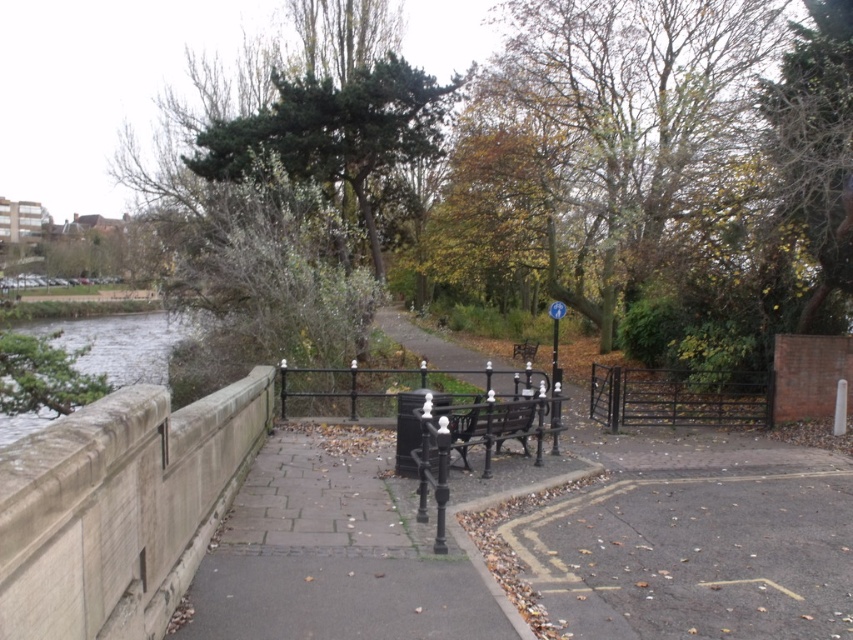
Does yellow-green foliage at upper center have a lesser width compared to black wrought iron bench at center?

Incorrect, yellow-green foliage at upper center's width is not less than black wrought iron bench at center's.

Can you confirm if yellow-green foliage at upper center is smaller than black wrought iron bench at center?

No, yellow-green foliage at upper center is not smaller than black wrought iron bench at center.

Between point (679, 145) and point (474, 417), which one is positioned behind?

The point (679, 145) is behind.

The height and width of the screenshot is (640, 853). Identify the location of yellow-green foliage at upper center. click(618, 125).

Measure the distance between clear water at edge at left and camera.

clear water at edge at left is 39.84 feet from camera.

Is point (135, 330) positioned after point (495, 403)?

Yes, point (135, 330) is behind point (495, 403).

In order to click on clear water at edge at left in this screenshot , I will do `click(119, 342)`.

Who is lower down, yellow-green foliage at upper center or clear water at edge at left?

clear water at edge at left is below.

Can you confirm if yellow-green foliage at upper center is bigger than clear water at edge at left?

No, yellow-green foliage at upper center is not bigger than clear water at edge at left.

I want to click on yellow-green foliage at upper center, so click(x=618, y=125).

Find the location of `yellow-green foliage at upper center`. yellow-green foliage at upper center is located at coordinates (618, 125).